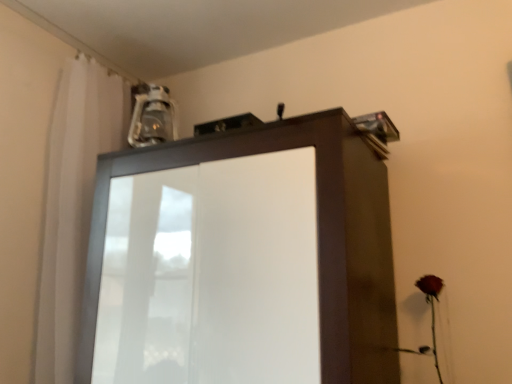
Question: Is matte brown cupboard at upper center to the left or to the right of white sheer curtain at upper left in the image?

Choices:
 (A) left
 (B) right

Answer: (B)

Question: From the image's perspective, is matte brown cupboard at upper center located above or below white sheer curtain at upper left?

Choices:
 (A) below
 (B) above

Answer: (A)

Question: Which object is positioned farthest from the matte brown cupboard at upper center?

Choices:
 (A) white sheer curtain at upper left
 (B) matte red rose at lower right

Answer: (B)

Question: Which object is positioned closest to the white sheer curtain at upper left?

Choices:
 (A) matte brown cupboard at upper center
 (B) matte red rose at lower right

Answer: (A)